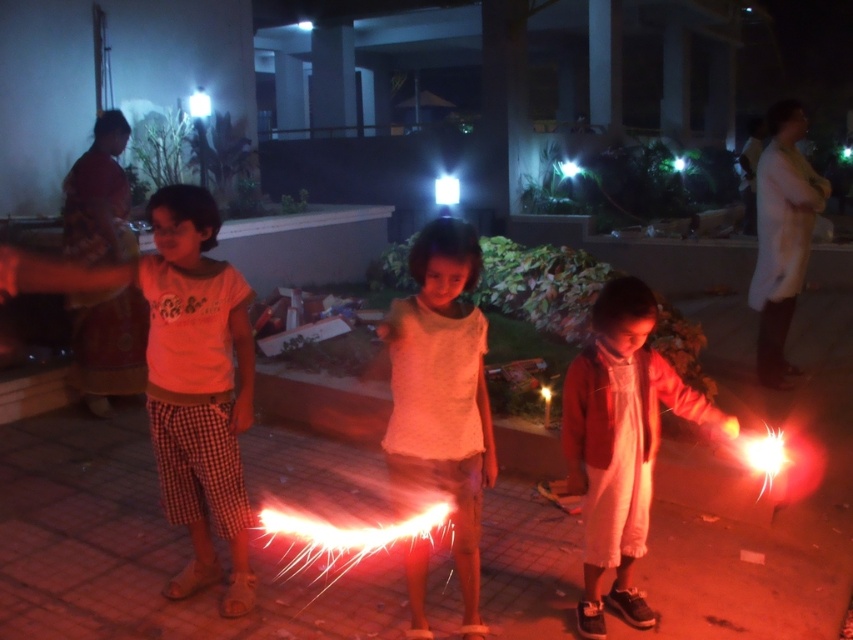
You are a photographer trying to capture the children in the scene. You want to focus on the matte orange shirt at left and the matte white dress at center. Which child should you adjust your camera focus on first to ensure they are in sharp view?

The matte orange shirt at left is closer to the viewer than the matte white dress at center, so you should focus on the matte orange shirt at left first to ensure proper sharpness.